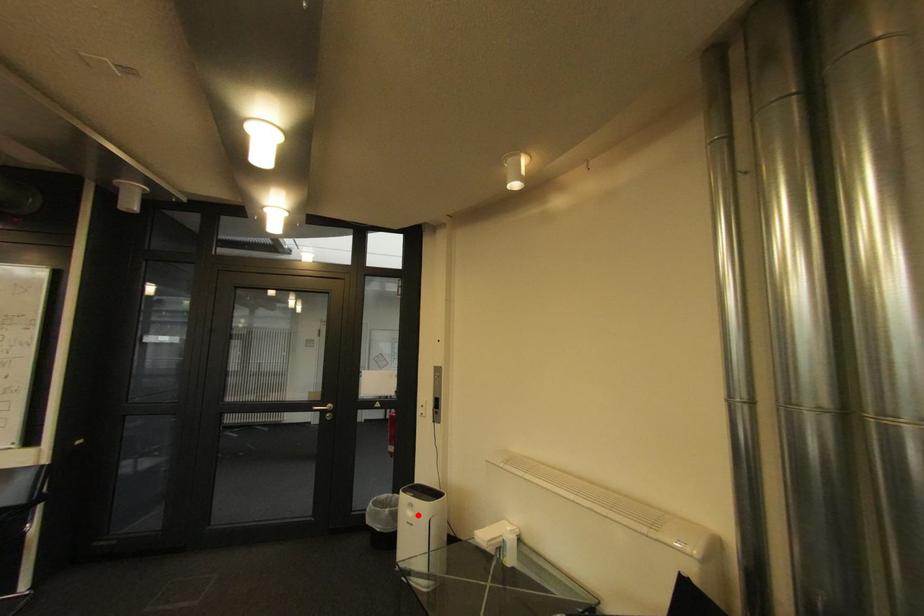
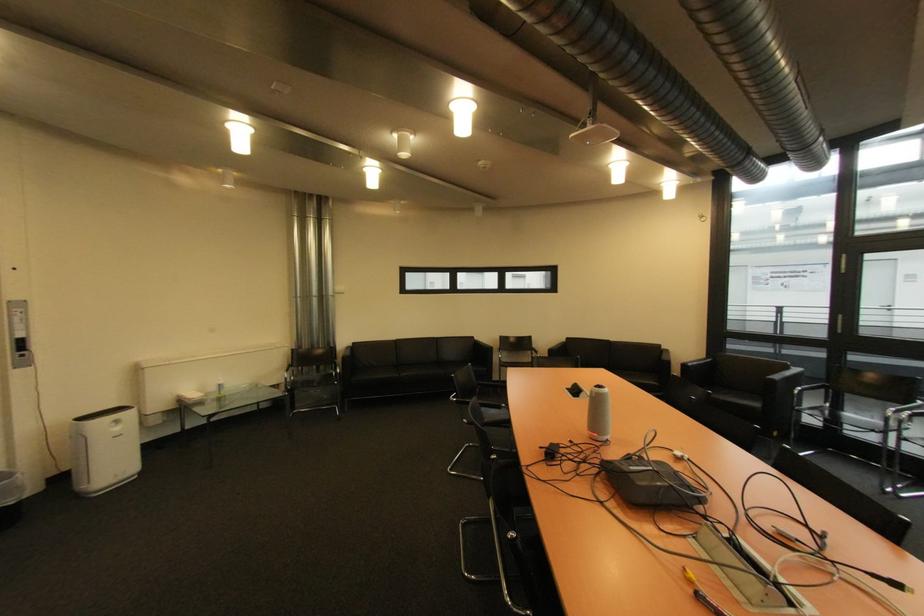
Locate, in the second image, the point that corresponds to the highlighted location in the first image.

(124, 430)